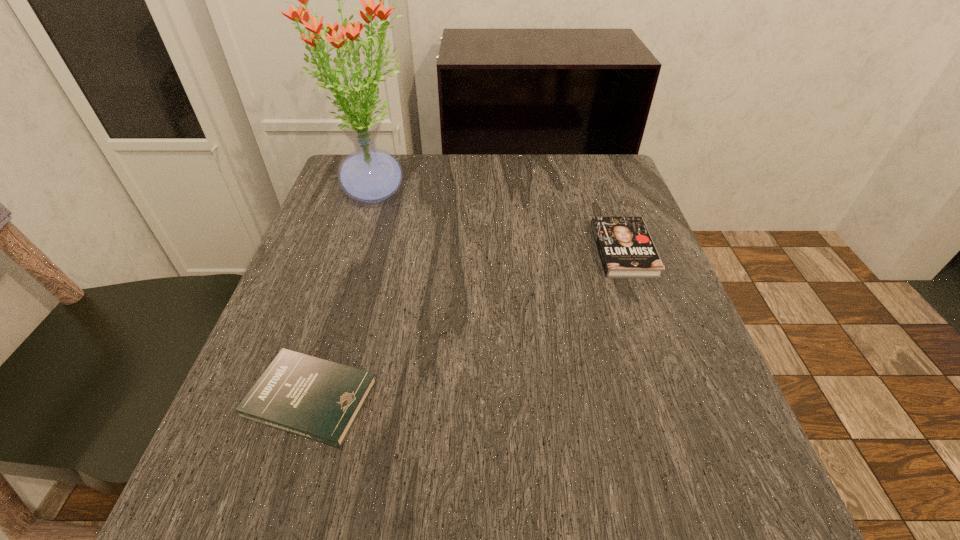
Locate an element on the screen. flower arrangement at the left edge is located at coordinates (369, 174).

The height and width of the screenshot is (540, 960). I want to click on book that is at the left edge, so click(317, 399).

Image resolution: width=960 pixels, height=540 pixels. Identify the location of object that is at the right edge. (626, 250).

Where is `object located in the far left corner section of the desktop`? object located in the far left corner section of the desktop is located at coordinates (369, 174).

In the image, there is a desktop. Identify the location of free space at the far edge. tap(464, 178).

At what (x,y) coordinates should I click in order to perform the action: click on blank space at the near edge of the desktop. Please return your answer as a coordinate pair (x, y). This screenshot has height=540, width=960. Looking at the image, I should click on (446, 487).

The image size is (960, 540). What are the coordinates of `free space at the left edge of the desktop` in the screenshot? It's located at (378, 242).

Where is `free space at the right edge`? Image resolution: width=960 pixels, height=540 pixels. free space at the right edge is located at coordinates (663, 292).

In order to click on vacant space at the near left corner of the desktop in this screenshot , I will do `click(249, 485)`.

Locate an element on the screen. The height and width of the screenshot is (540, 960). vacant space at the far right corner of the desktop is located at coordinates (601, 165).